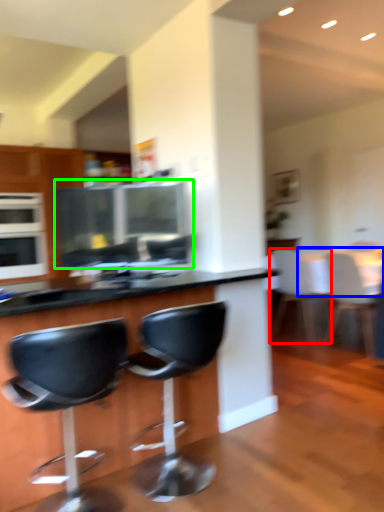
Question: Which object is positioned closest to chair (highlighted by a red box)? Select from table (highlighted by a blue box) and appliance (highlighted by a green box).

Choices:
 (A) table
 (B) appliance

Answer: (A)